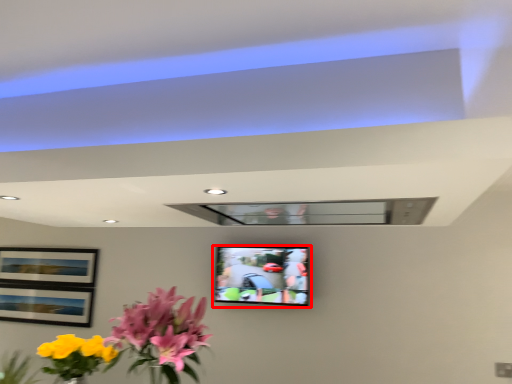
Question: From the image's perspective, what is the correct spatial relationship of television (annotated by the red box) in relation to flower?

Choices:
 (A) above
 (B) below

Answer: (A)